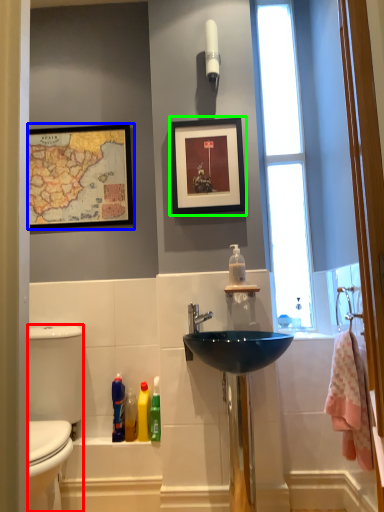
Question: Which object is the farthest from gray (highlighted by a red box)? Choose among these: picture frame (highlighted by a blue box) or picture frame (highlighted by a green box).

Choices:
 (A) picture frame
 (B) picture frame

Answer: (B)